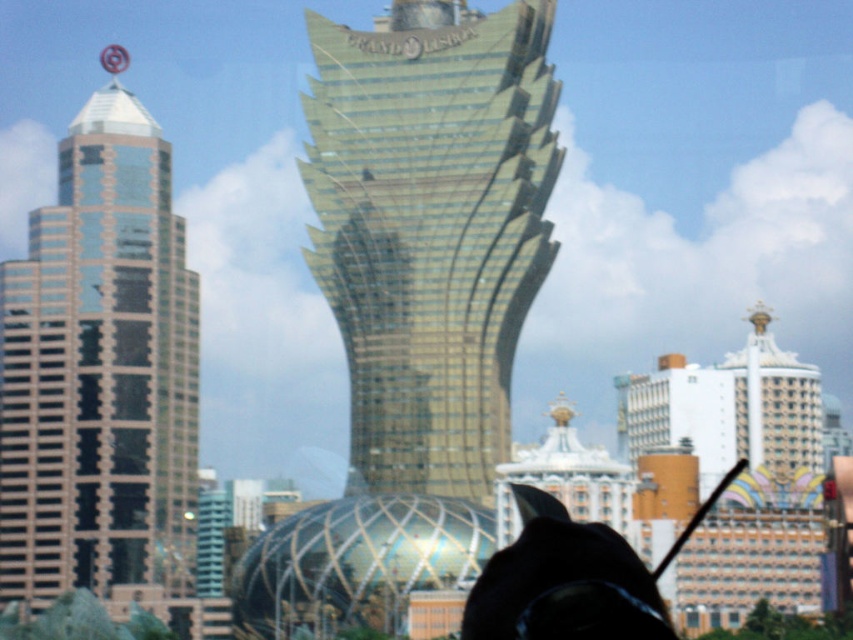
You are a photographer standing in the city and want to capture both the gold glass tower at center and the shiny glass skyscraper at left in a single frame. Based on their positions, which building should you focus on first to ensure both are in the shot?

The gold glass tower at center is positioned on the right side of shiny glass skyscraper at left, so you should focus on the shiny glass skyscraper at left first to ensure both are in the shot.

You are a city planner analyzing the Grand Lisbon area. You need to determine which building has a greater width between the gold glass tower at center and the shiny glass skyscraper at left. Which one is wider?

The gold glass tower at center is wider than the shiny glass skyscraper at left according to the description.

You are a photographer standing at the center of the city. You want to capture both the shiny glass skyscraper at left and the black matte hat at lower center in the same frame. Which object will appear bigger in the photo?

The shiny glass skyscraper at left will appear bigger in the photo because it is larger in size than the black matte hat at lower center.